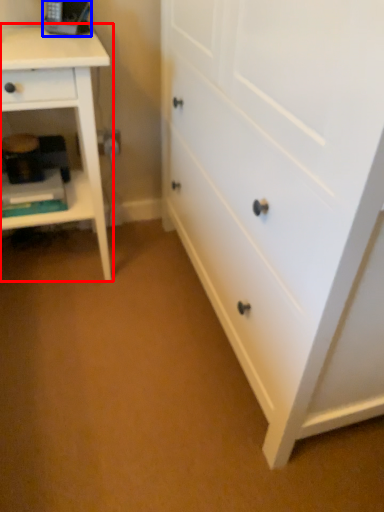
Question: Which object is further to the camera taking this photo, nightstand (highlighted by a red box) or equipment (highlighted by a blue box)?

Choices:
 (A) nightstand
 (B) equipment

Answer: (B)